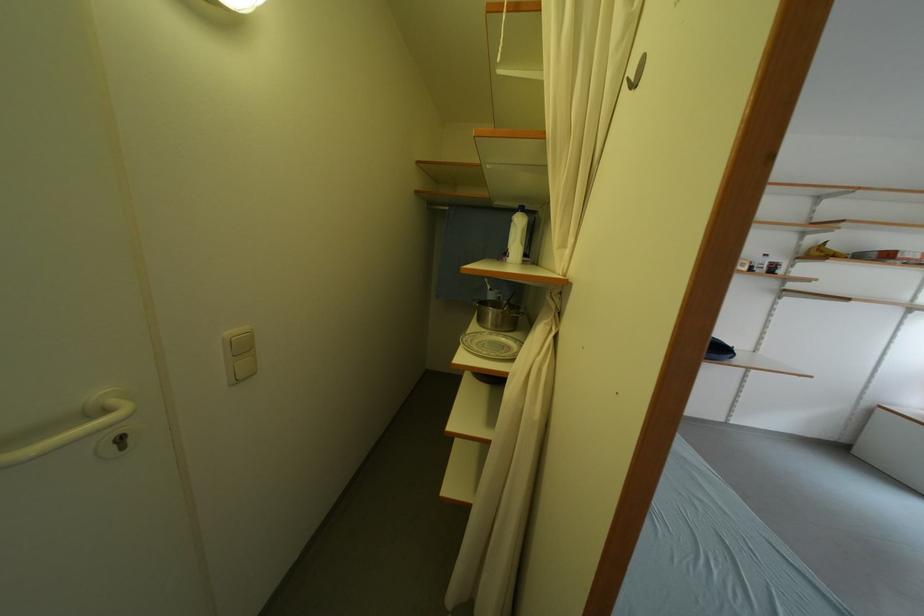
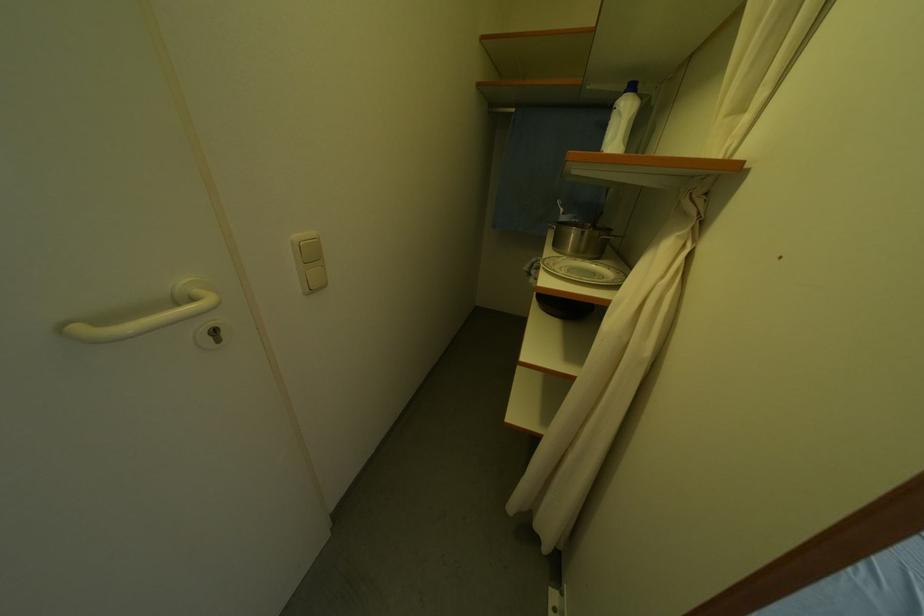
Locate, in the second image, the point that corresponds to (x=237, y=336) in the first image.

(306, 238)